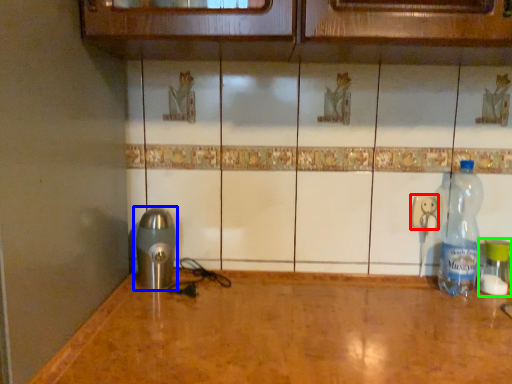
Question: Based on their relative distances, which object is farther from electric outlet (highlighted by a red box)? Choose from appliance (highlighted by a blue box) and bottle (highlighted by a green box).

Choices:
 (A) appliance
 (B) bottle

Answer: (A)